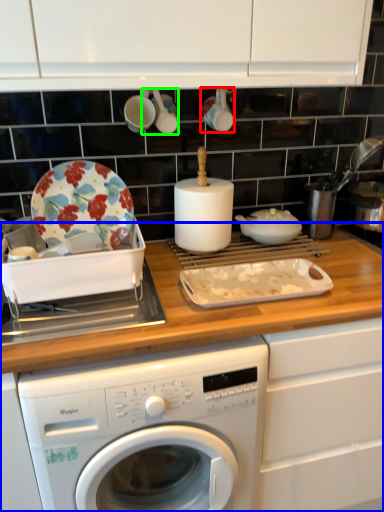
Question: Based on their relative distances, which object is nearer to tableware (highlighted by a red box)? Choose from countertop (highlighted by a blue box) and tableware (highlighted by a green box).

Choices:
 (A) countertop
 (B) tableware

Answer: (B)